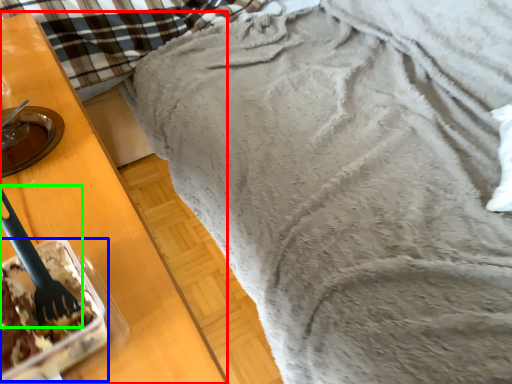
Question: Estimate the real-world distances between objects in this image. Which object is farther from furniture (highlighted by a red box), dessert (highlighted by a blue box) or silverware (highlighted by a green box)?

Choices:
 (A) dessert
 (B) silverware

Answer: (B)